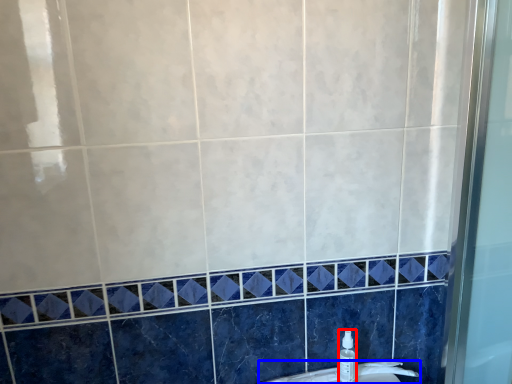
Question: Which object is further to the camera taking this photo, toiletry (highlighted by a red box) or sink (highlighted by a blue box)?

Choices:
 (A) toiletry
 (B) sink

Answer: (B)